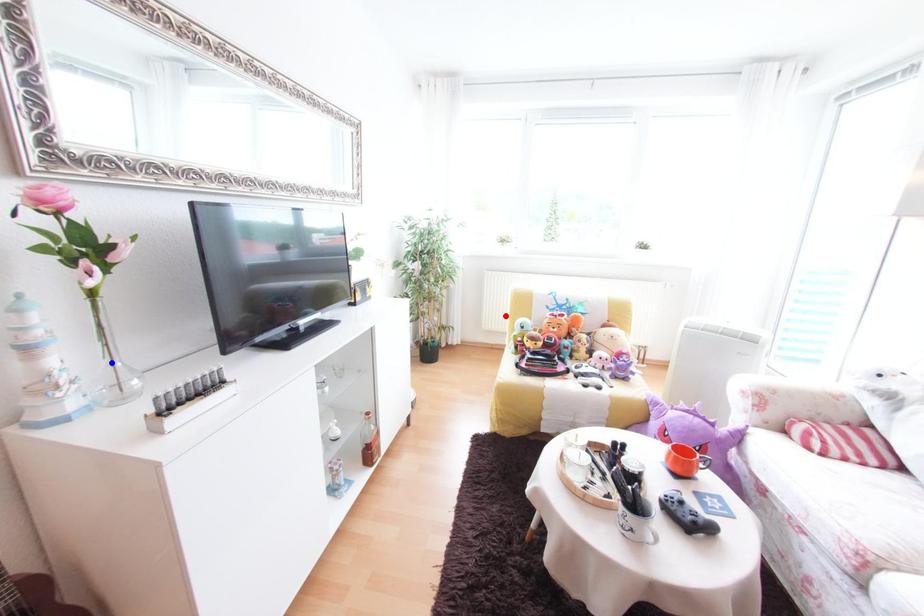
Question: Which of the two points in the image is closer to the camera?

Choices:
 (A) Blue point is closer.
 (B) Red point is closer.

Answer: (A)